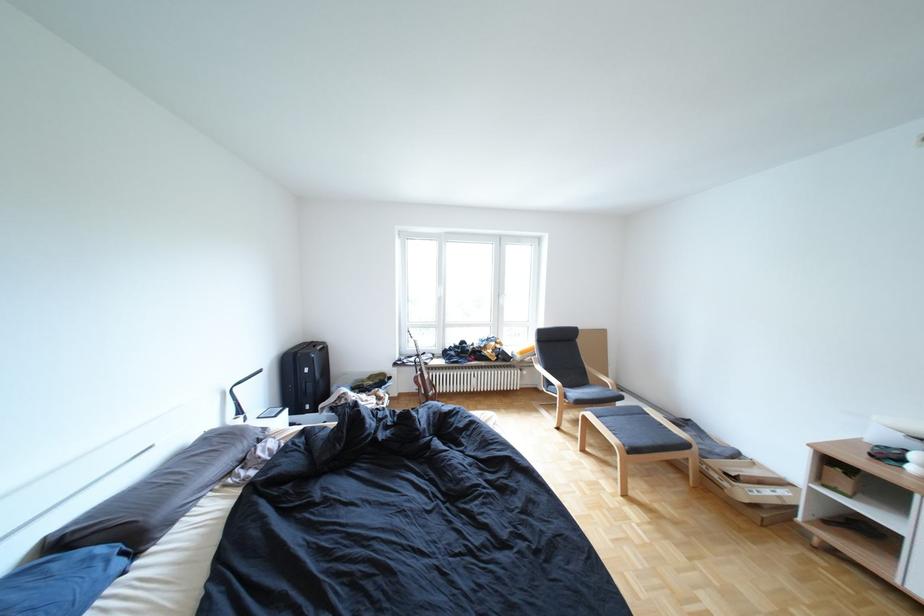
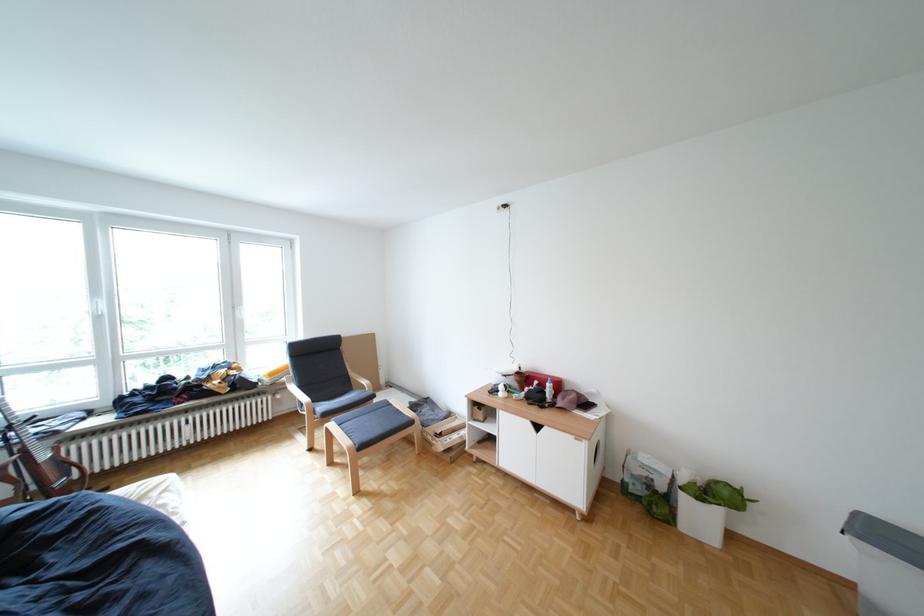
Find the pixel in the second image that matches point 637,398 in the first image.

(388, 397)